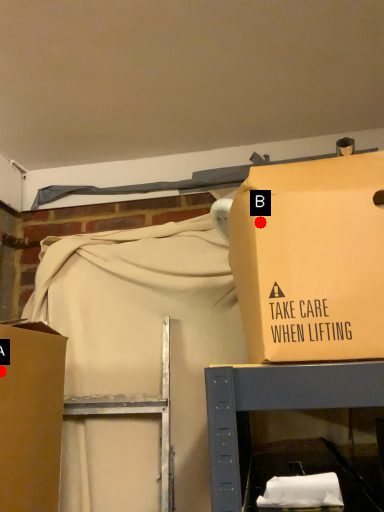
Question: Two points are circled on the image, labeled by A and B beside each circle. Among these points, which one is nearest to the camera?

Choices:
 (A) A is closer
 (B) B is closer

Answer: (B)